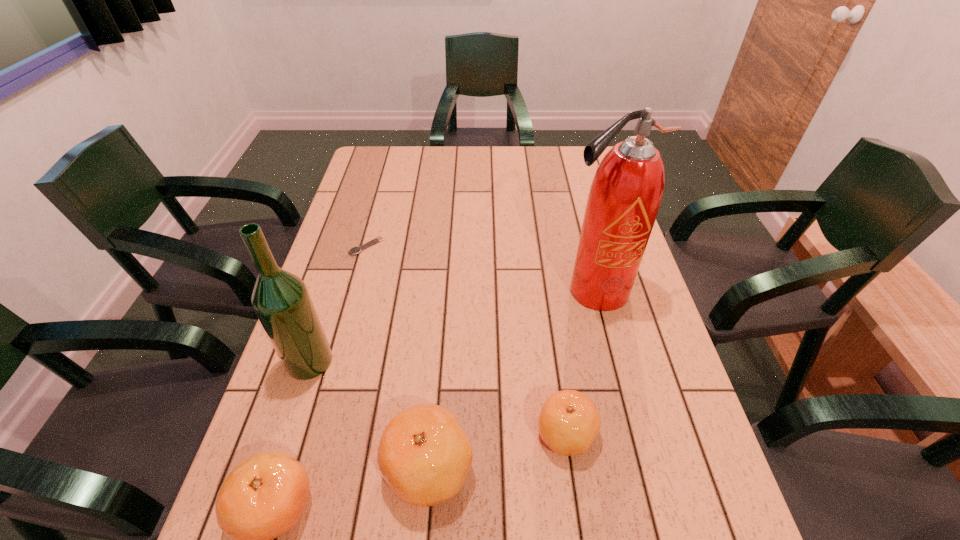
In the current image, all clementines are evenly spaced. To maintain this equal spacing, where should an additional clementine be placed on the right? Please point out a free spot. Please provide its 2D coordinates. Your answer should be formatted as a tuple, i.e. [(x, y)], where the tuple contains the x and y coordinates of a point satisfying the conditions above.

[(688, 403)]